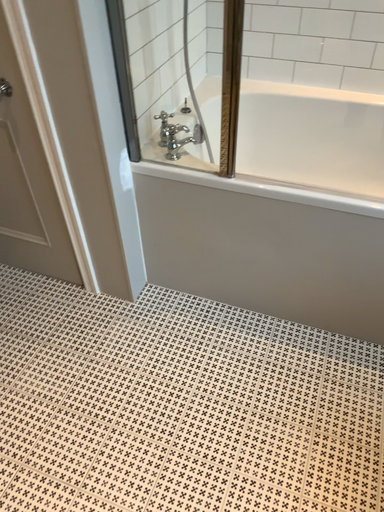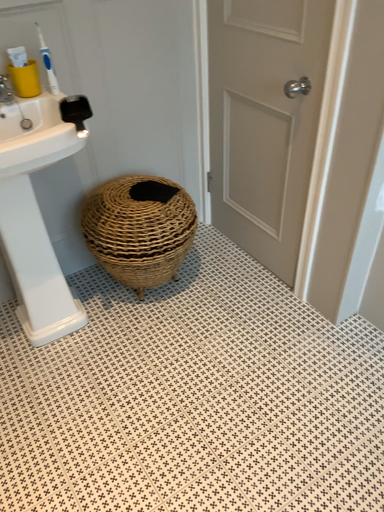
Question: How did the camera likely rotate when shooting the video?

Choices:
 (A) rotated right
 (B) rotated left

Answer: (B)